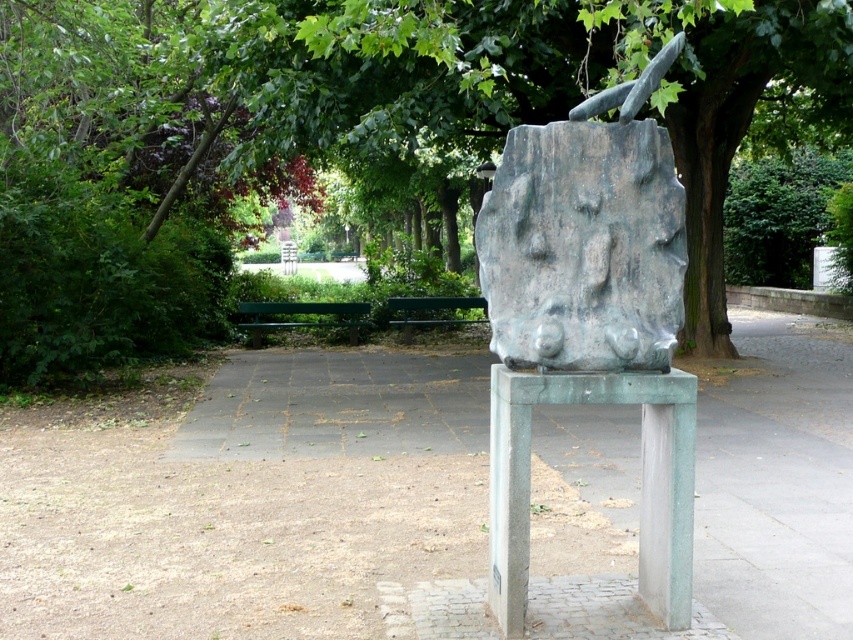
Question: Which point is farther from the camera taking this photo?

Choices:
 (A) (508, 534)
 (B) (280, 326)
 (C) (315, 29)

Answer: (B)

Question: Is gray stone sculpture at center above green metal bench at center?

Choices:
 (A) yes
 (B) no

Answer: (B)

Question: Which object appears closest to the camera in this image?

Choices:
 (A) green painted wood bench at center
 (B) green patinated stone stool at center

Answer: (B)

Question: Is gray stone sculpture at center further to the viewer compared to green painted wood bench at center?

Choices:
 (A) no
 (B) yes

Answer: (A)

Question: Can you confirm if green leafy tree at center is positioned to the right of gray stone sculpture at center?

Choices:
 (A) yes
 (B) no

Answer: (A)

Question: Which point is farther from the camera taking this photo?

Choices:
 (A) tap(489, 193)
 (B) tap(788, 102)
 (C) tap(462, 298)

Answer: (C)